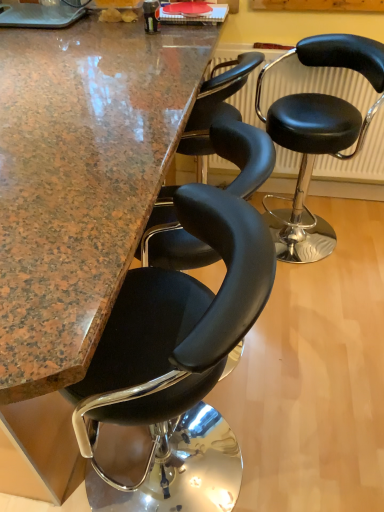
Question: From a real-world perspective, is black leather stool at center, the first chair in the left-to-right sequence, beneath black leather radiator at center?

Choices:
 (A) yes
 (B) no

Answer: (A)

Question: Is black leather stool at center, the first chair in the left-to-right sequence, not within black leather radiator at center?

Choices:
 (A) no
 (B) yes

Answer: (B)

Question: From a real-world perspective, is black leather stool at center, the first chair in the left-to-right sequence, over black leather radiator at center?

Choices:
 (A) yes
 (B) no

Answer: (B)

Question: Considering the relative sizes of black leather stool at center, the 2th chair from the back, and black leather radiator at center in the image provided, is black leather stool at center, the 2th chair from the back, smaller than black leather radiator at center?

Choices:
 (A) yes
 (B) no

Answer: (B)

Question: Is black leather stool at center, the first chair in the left-to-right sequence, turned away from black leather radiator at center?

Choices:
 (A) yes
 (B) no

Answer: (B)

Question: From their relative heights in the image, would you say black leather stool at center, marked as the first chair in a right-to-left arrangement, is taller or shorter than granite countertop at center?

Choices:
 (A) tall
 (B) short

Answer: (B)

Question: In the image, is black leather stool at center, marked as the second chair in a left-to-right arrangement, positioned in front of or behind granite countertop at center?

Choices:
 (A) front
 (B) behind

Answer: (B)

Question: Is point (306, 134) positioned closer to the camera than point (66, 48)?

Choices:
 (A) farther
 (B) closer

Answer: (A)

Question: In the image, is black leather stool at center, the second chair when ordered from front to back, on the left side or the right side of granite countertop at center?

Choices:
 (A) right
 (B) left

Answer: (A)

Question: From a real-world perspective, is black leather radiator at center physically located above or below black leather stool at center, the 2th chair from the back?

Choices:
 (A) below
 (B) above

Answer: (B)

Question: Considering the positions of black leather radiator at center and black leather stool at center, the 2th chair from the back, in the image, is black leather radiator at center bigger or smaller than black leather stool at center, the 2th chair from the back,?

Choices:
 (A) big
 (B) small

Answer: (B)

Question: From the image's perspective, is black leather radiator at center located above or below black leather stool at center, the 2th chair when ordered from right to left?

Choices:
 (A) below
 (B) above

Answer: (B)

Question: Is black leather radiator at center taller or shorter than black leather stool at center, the 2th chair when ordered from right to left?

Choices:
 (A) short
 (B) tall

Answer: (A)

Question: Looking at their shapes, would you say black leather stool at center, the first chair in the left-to-right sequence, is wider or thinner than black leather stool at center, marked as the first chair in a right-to-left arrangement?

Choices:
 (A) thin
 (B) wide

Answer: (B)

Question: Would you say black leather stool at center, the first chair in the left-to-right sequence, is inside or outside black leather stool at center, the second chair when ordered from front to back?

Choices:
 (A) inside
 (B) outside

Answer: (B)